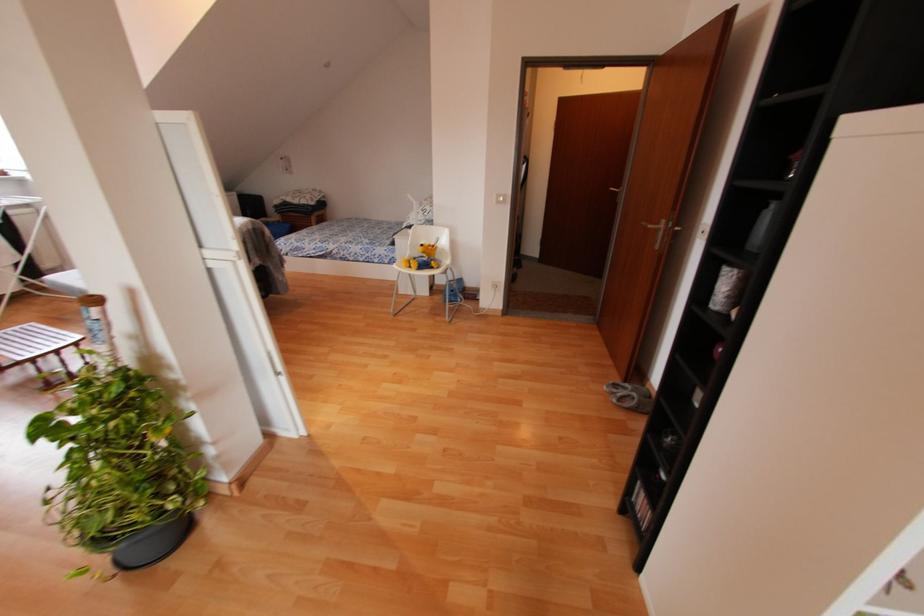
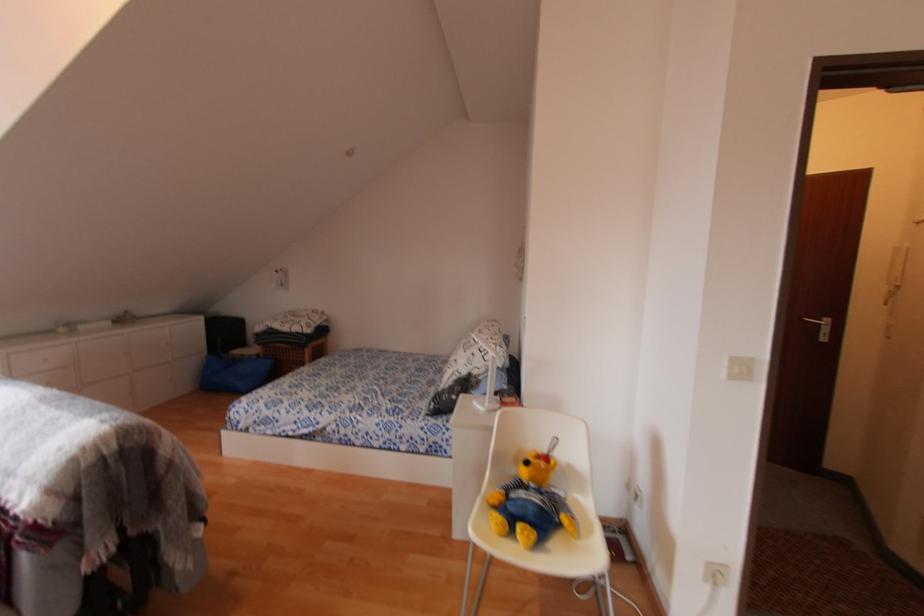
The point at (421, 246) is marked in the first image. Where is the corresponding point in the second image?

(527, 463)